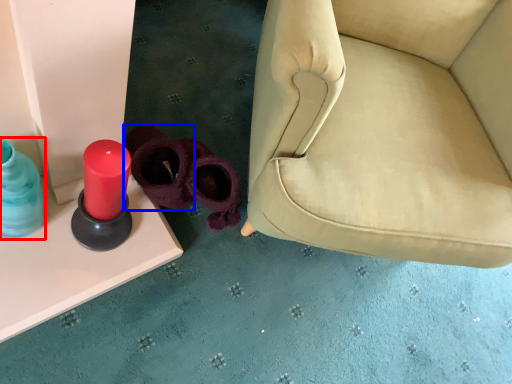
Question: Which point is closer to the camera, bottle (highlighted by a red box) or footwear (highlighted by a blue box)?

Choices:
 (A) bottle
 (B) footwear

Answer: (A)